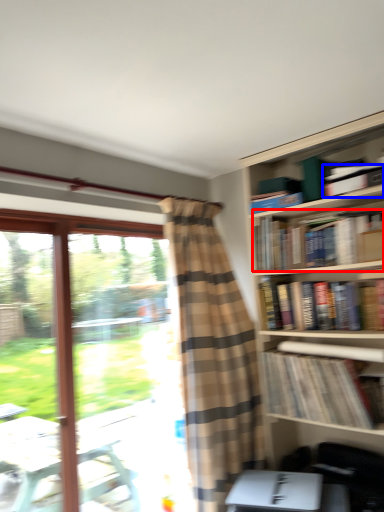
Question: Which point is closer to the camera, book (highlighted by a red box) or book (highlighted by a blue box)?

Choices:
 (A) book
 (B) book

Answer: (A)